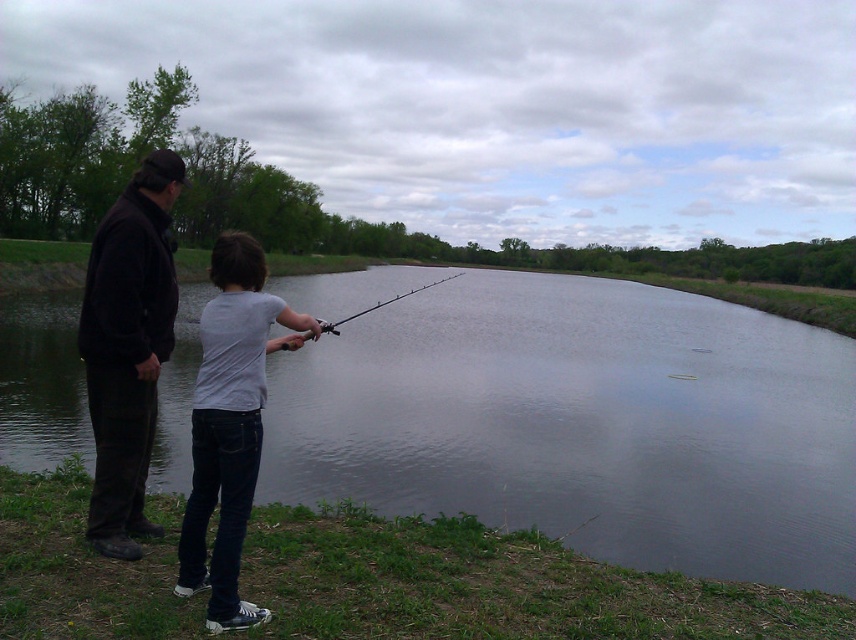
You are a photographer trying to capture the child fishing in the scene. You notice the white matte shirt at center and the smooth black rod at center. Which object should you focus on if you want to highlight something smaller in the image?

The white matte shirt at center is smaller than the smooth black rod at center, so focusing on the white matte shirt at center would highlight the smaller object.

You are standing on the grassy bank and want to hand a fishing guide to the adult wearing the dark brown leather jacket at left. The guide is currently on the smooth black rod at center. Which direction should you move to retrieve it before giving it to them?

Since the dark brown leather jacket at left is to the left of the smooth black rod at center, you should move to the right to retrieve the guide from the smooth black rod at center and then go back left to give it to the adult.

You are a photographer trying to capture a candid shot of the scene. You notice the white matte shirt at center and the smooth black rod at center. Which object should you focus on if you want to highlight something closer to the water surface?

The white matte shirt at center has a lesser height compared to the smooth black rod at center, so focusing on the white matte shirt at center would better highlight something closer to the water surface.